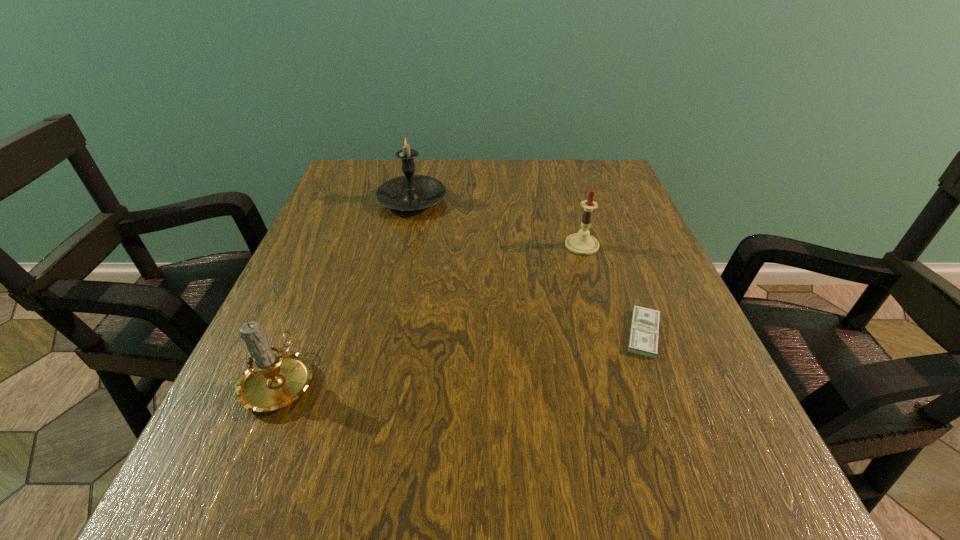
Where is `free space that is in between the money and the farthest candle`? free space that is in between the money and the farthest candle is located at coordinates (528, 267).

At what (x,y) coordinates should I click in order to perform the action: click on vacant area between the rightmost candle and the money. Please return your answer as a coordinate pair (x, y). Image resolution: width=960 pixels, height=540 pixels. Looking at the image, I should click on (612, 289).

Identify which object is the third nearest to the leftmost object. Please provide its 2D coordinates. Your answer should be formatted as a tuple, i.e. [(x, y)], where the tuple contains the x and y coordinates of a point satisfying the conditions above.

[(582, 243)]

The image size is (960, 540). Identify the location of object that is the second nearest to the second farthest object. (410, 192).

I want to click on candle that is the second closest to the nearest candle, so click(x=582, y=243).

Find the location of a particular element. Image resolution: width=960 pixels, height=540 pixels. candle identified as the closest to the farthest candle is located at coordinates (582, 243).

The width and height of the screenshot is (960, 540). I want to click on free space in the image that satisfies the following two spatial constraints: 1. on the back side of the rightmost candle; 2. on the left side of the nearest candle, so pos(336,245).

Find the location of `vacant space that satisfies the following two spatial constraints: 1. on the front side of the second nearest candle; 2. on the right side of the money`. vacant space that satisfies the following two spatial constraints: 1. on the front side of the second nearest candle; 2. on the right side of the money is located at coordinates (608, 334).

The width and height of the screenshot is (960, 540). I want to click on free point that satisfies the following two spatial constraints: 1. on the front side of the third object from right to left; 2. on the right side of the rightmost candle, so click(x=402, y=245).